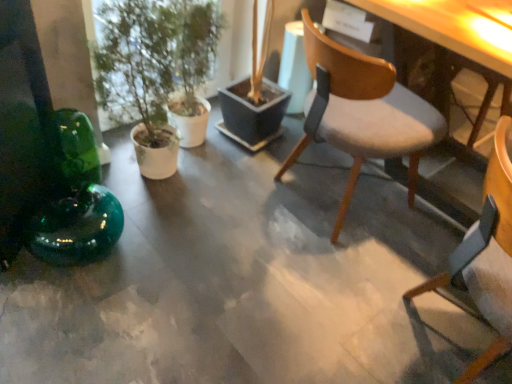
Question: Does point (116, 107) appear closer or farther from the camera than point (334, 107)?

Choices:
 (A) farther
 (B) closer

Answer: (B)

Question: In the image, is green matte plant at left positioned in front of or behind light gray fabric chair at center, the first chair in the back-to-front sequence?

Choices:
 (A) behind
 (B) front

Answer: (A)

Question: Which object is positioned closest to the wooden chair at center, which is the second chair in back-to-front order?

Choices:
 (A) green matte plant at left
 (B) light gray fabric chair at center, which is the 2th chair from front to back

Answer: (B)

Question: Estimate the real-world distances between objects in this image. Which object is farther from the wooden chair at center, the first chair when ordered from front to back?

Choices:
 (A) light gray fabric chair at center, the first chair in the back-to-front sequence
 (B) green matte plant at left

Answer: (B)